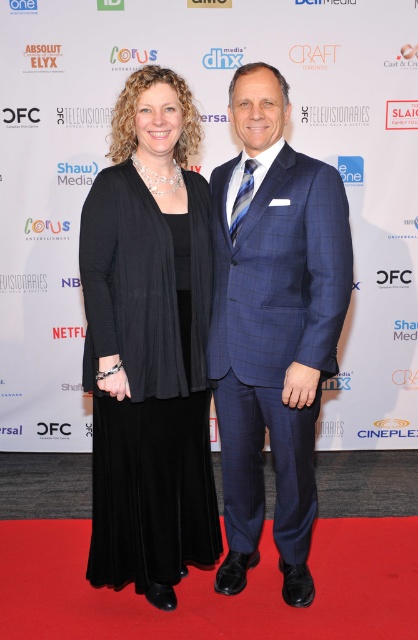
Question: Can you confirm if black matte dress at center is positioned to the right of blue checkered suit at center?

Choices:
 (A) yes
 (B) no

Answer: (B)

Question: Which object appears closest to the camera in this image?

Choices:
 (A) blue checkered suit at center
 (B) black matte dress at center

Answer: (A)

Question: Which object is closer to the camera taking this photo?

Choices:
 (A) blue checkered suit at center
 (B) black matte dress at center

Answer: (A)

Question: Is black matte dress at center wider than blue checkered suit at center?

Choices:
 (A) yes
 (B) no

Answer: (A)

Question: Is black matte dress at center bigger than blue checkered suit at center?

Choices:
 (A) yes
 (B) no

Answer: (B)